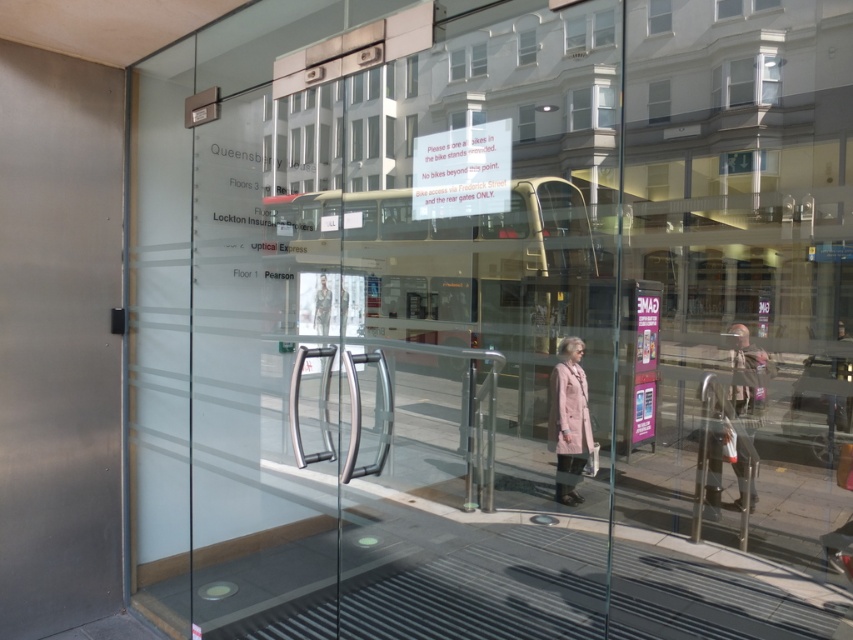
Can you confirm if light brown leather jacket at right is positioned to the right of light pink wool coat at center?

Correct, you'll find light brown leather jacket at right to the right of light pink wool coat at center.

The image size is (853, 640). I want to click on light brown leather jacket at right, so click(747, 376).

You are a GUI agent. You are given a task and a screenshot of the screen. Output one action in this format:
    pyautogui.click(x=<x>, y=<y>)
    Task: Click on the light brown leather jacket at right
    
    Given the screenshot: What is the action you would take?
    pyautogui.click(x=747, y=376)